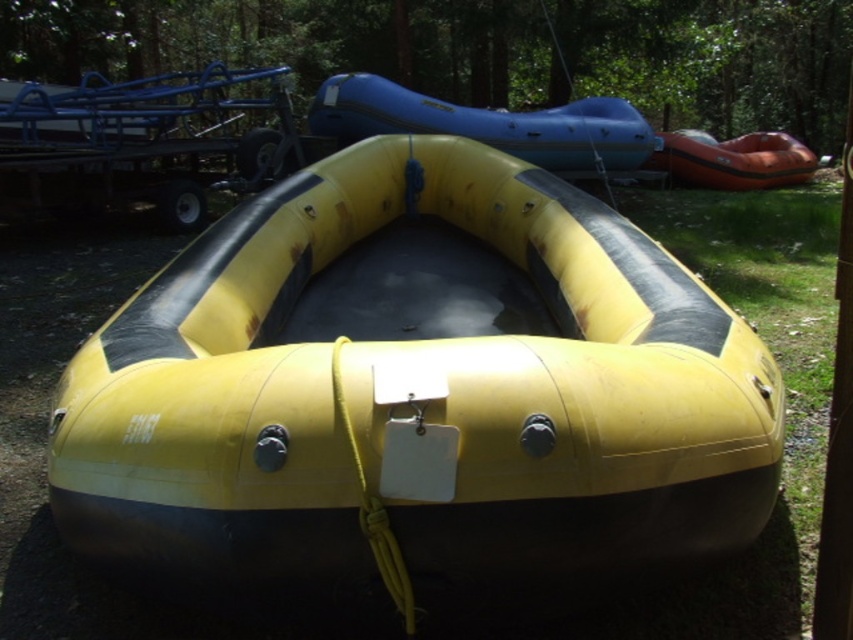
Question: Does yellow rubber boat at center appear on the left side of orange rubber raft at upper right?

Choices:
 (A) no
 (B) yes

Answer: (B)

Question: Considering the real-world distances, which object is closest to the yellow rubber boat at center?

Choices:
 (A) orange rubber raft at upper right
 (B) rubberized blue raft at upper center

Answer: (B)

Question: Does yellow rubber boat at center appear under rubberized blue raft at upper center?

Choices:
 (A) no
 (B) yes

Answer: (B)

Question: Does yellow rubber boat at center have a smaller size compared to rubberized blue raft at upper center?

Choices:
 (A) no
 (B) yes

Answer: (A)

Question: Estimate the real-world distances between objects in this image. Which object is farther from the yellow rubber boat at center?

Choices:
 (A) orange rubber raft at upper right
 (B) rubberized blue raft at upper center

Answer: (A)

Question: Which of the following is the farthest from the observer?

Choices:
 (A) orange rubber raft at upper right
 (B) rubberized blue raft at upper center
 (C) yellow rubber boat at center

Answer: (A)